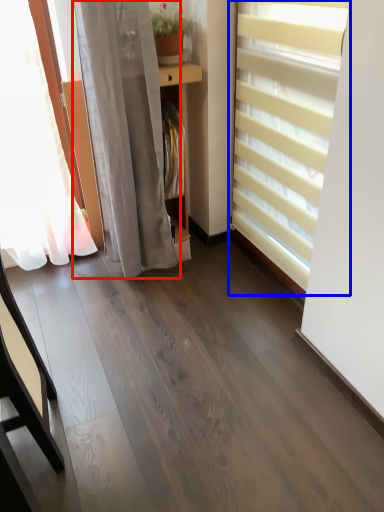
Question: Which object appears closest to the camera in this image, curtain (highlighted by a red box) or window blind (highlighted by a blue box)?

Choices:
 (A) curtain
 (B) window blind

Answer: (B)